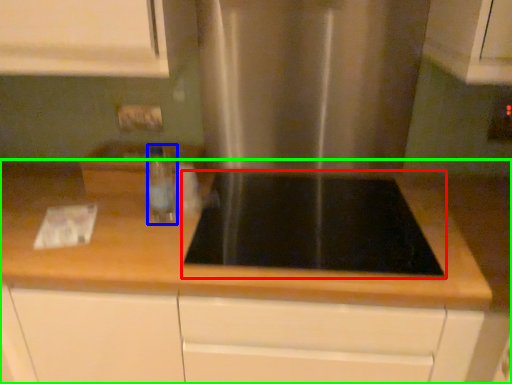
Question: Considering the real-world distances, which object is farthest from gas stove (highlighted by a red box)? bottle (highlighted by a blue box) or countertop (highlighted by a green box)?

Choices:
 (A) bottle
 (B) countertop

Answer: (A)